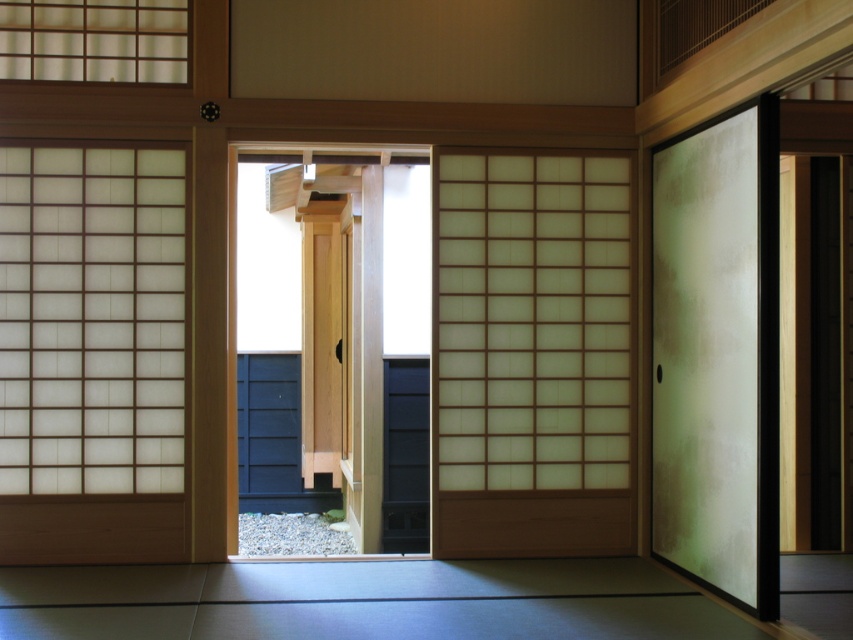
Is satin white screen at center smaller than frosted glass sliding door at right?

Indeed, satin white screen at center has a smaller size compared to frosted glass sliding door at right.

Where is `satin white screen at center`? satin white screen at center is located at coordinates (531, 355).

At what (x,y) coordinates should I click in order to perform the action: click on satin white screen at center. Please return your answer as a coordinate pair (x, y). Looking at the image, I should click on (531, 355).

Does satin white screen at center appear under light wood door at center?

No, satin white screen at center is not below light wood door at center.

Is point (502, 224) positioned in front of point (331, 298)?

Yes, point (502, 224) is closer to viewer.

The image size is (853, 640). In order to click on satin white screen at center in this screenshot , I will do `click(531, 355)`.

Between frosted glass sliding door at right and light wood door at center, which one appears on the left side from the viewer's perspective?

light wood door at center is more to the left.

Consider the image. Can you confirm if frosted glass sliding door at right is positioned above light wood door at center?

Indeed, frosted glass sliding door at right is positioned over light wood door at center.

What are the coordinates of `frosted glass sliding door at right` in the screenshot? It's located at (717, 355).